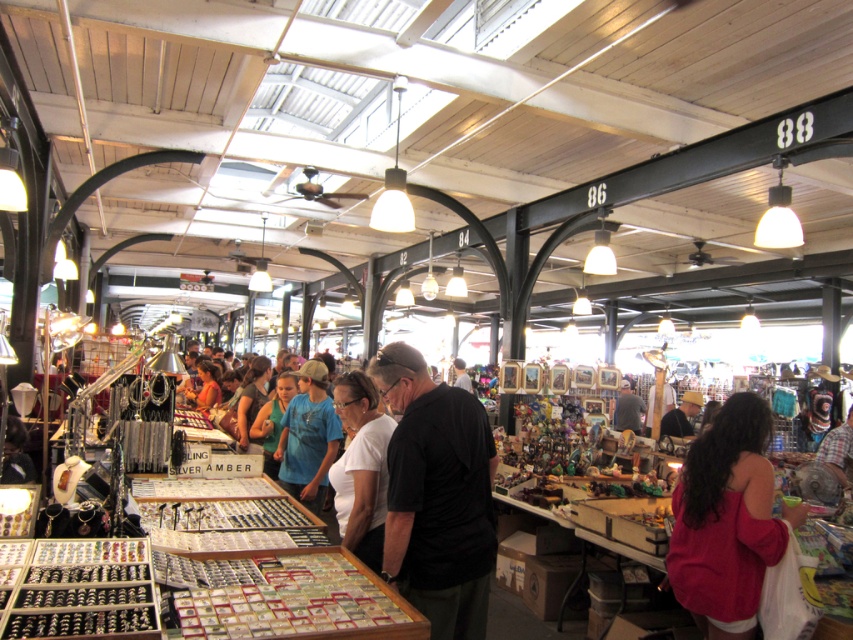
You are a customer at the flea market and want to pick up both the red matte sweater at lower right and the gray fabric shirt at center. Which item should you grab first if you want to start from the leftmost item?

The red matte sweater at lower right is to the left of the gray fabric shirt at center, so you should grab the red matte sweater at lower right first.